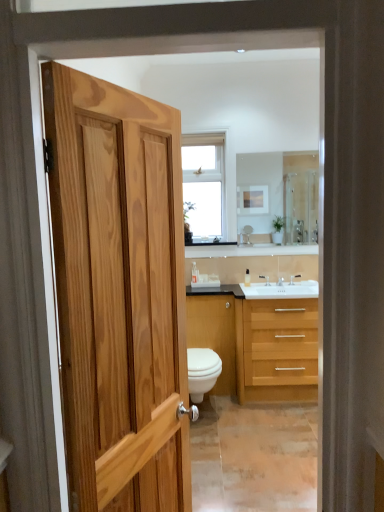
Question: From the image's perspective, is clear glass mirror at upper center above or below silver metallic faucet at center, the 3th faucet when ordered from left to right?

Choices:
 (A) below
 (B) above

Answer: (B)

Question: Does point (291, 162) appear closer or farther from the camera than point (289, 279)?

Choices:
 (A) closer
 (B) farther

Answer: (A)

Question: Based on their relative distances, which object is nearer to the clear glass mirror at upper center?

Choices:
 (A) clear glass window at upper center
 (B) silver metallic faucet at center, which is counted as the 3th faucet, starting from the right
 (C) satin nickel faucet at center, which appears as the 2th faucet when viewed from the left
 (D) white glossy toilet at center
 (E) silver metallic faucet at center, the 3th faucet when ordered from left to right

Answer: (A)

Question: Which of these objects is positioned closest to the light wood/finished cabinet at center?

Choices:
 (A) white glossy toilet at center
 (B) translucent plastic bottle at center
 (C) silver metallic faucet at center, which is counted as the 3th faucet, starting from the right
 (D) white glossy cabinet at center
 (E) silver metallic faucet at center, which is the first faucet from right to left

Answer: (D)